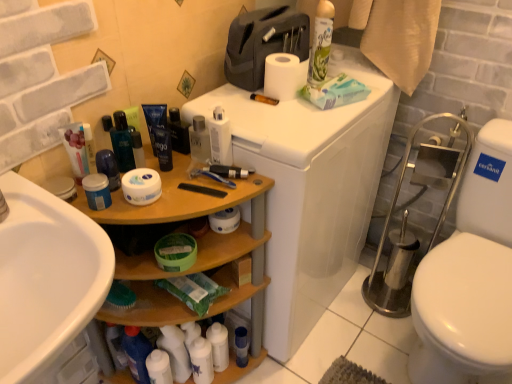
In order to click on vacant area located to the right-hand side of matte blue jar at center, positioned as the 3th toiletry in left-to-right order in this screenshot , I will do `click(183, 190)`.